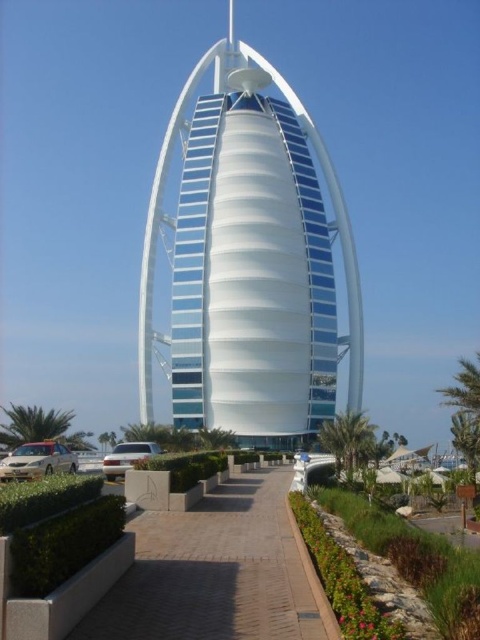
You are standing at the entrance of the Burj Al Arab hotel and want to reach the main entrance. You see two points marked on the ground ahead of you. The first point is at coordinate point(x=250, y=161) and the second is at point(x=241, y=541). Which point is closer to the main entrance?

Point(x=241, y=541) is closer to the main entrance because it is in front of point(x=250, y=161), which is behind it.

You are standing at the entrance of the Burj Al Arab and want to take a photo of the white glass tower at center. To avoid including the brick paved walkway at center in your photo, should you move to the left or right of the walkway?

Since the white glass tower at center is to the right of the brick paved walkway at center, moving to the right of the walkway would position the tower away from the walkway in the frame, allowing you to capture it without the walkway in the shot.